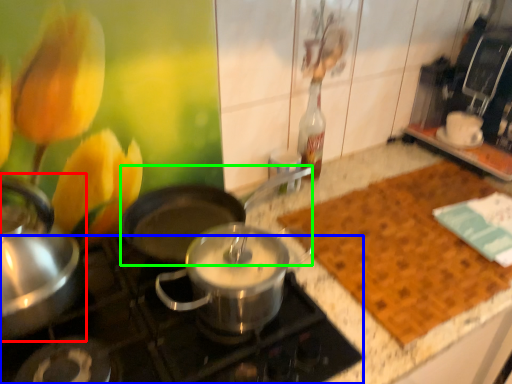
Question: Based on their relative distances, which object is farther from kitchen appliance (highlighted by a red box)? Choose from gas stove (highlighted by a blue box) and wok (highlighted by a green box).

Choices:
 (A) gas stove
 (B) wok

Answer: (B)